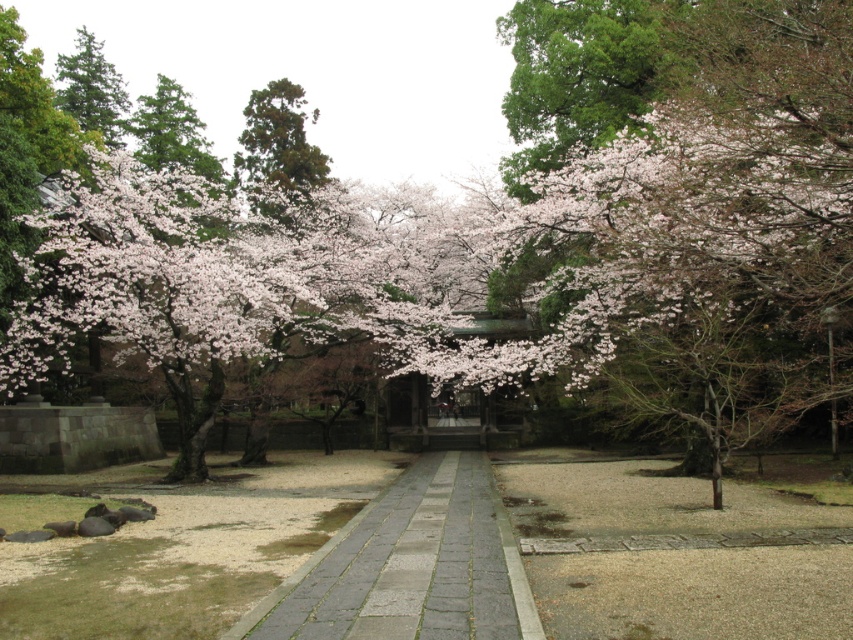
Question: Which point is closer to the camera taking this photo?

Choices:
 (A) (293, 182)
 (B) (277, 612)
 (C) (96, 54)
 (D) (498, 358)

Answer: (B)

Question: Considering the relative positions of soft pink blossoms at center and green textured pine tree at upper center in the image provided, where is soft pink blossoms at center located with respect to green textured pine tree at upper center?

Choices:
 (A) above
 (B) below

Answer: (B)

Question: Is gray stone pavement at center further to the viewer compared to green textured pine tree at upper center?

Choices:
 (A) no
 (B) yes

Answer: (A)

Question: Which point is farther to the camera?

Choices:
 (A) (82, 45)
 (B) (263, 154)
 (C) (479, 538)
 (D) (461, 216)

Answer: (A)

Question: Based on their relative distances, which object is nearer to the green matte tree at upper left?

Choices:
 (A) gray stone pavement at center
 (B) soft pink blossoms at center
 (C) green textured pine tree at upper center

Answer: (C)

Question: Is green textured pine tree at upper center wider than green matte tree at upper left?

Choices:
 (A) yes
 (B) no

Answer: (B)